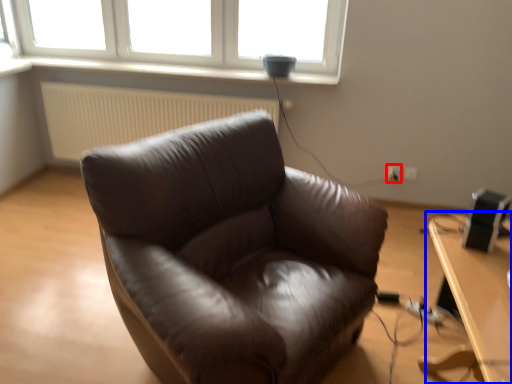
Question: Among these objects, which one is nearest to the camera, electric outlet (highlighted by a red box) or table (highlighted by a blue box)?

Choices:
 (A) electric outlet
 (B) table

Answer: (B)